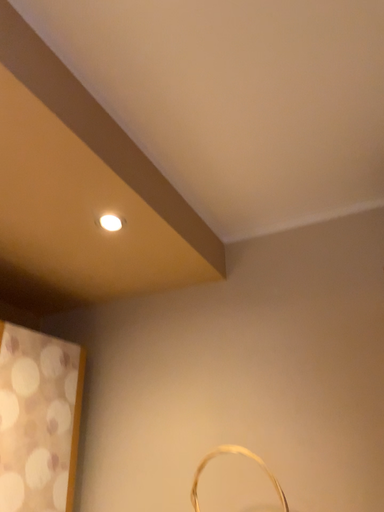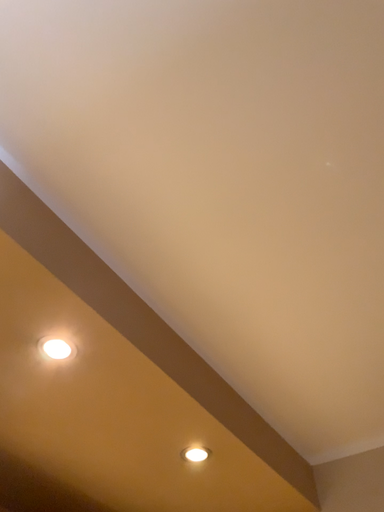
Question: How did the camera likely rotate when shooting the video?

Choices:
 (A) rotated upward
 (B) rotated downward

Answer: (A)